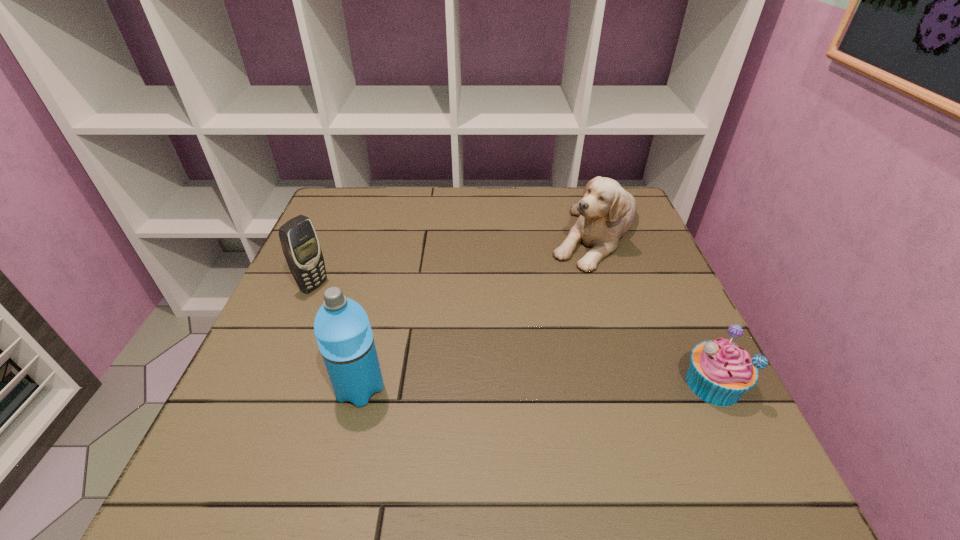
Identify the location of vacant area between the puppy and the third nearest object. The height and width of the screenshot is (540, 960). (454, 259).

Where is `blank region between the muffin and the puppy`? blank region between the muffin and the puppy is located at coordinates (654, 308).

Find the location of a particular element. free area in between the shortest object and the puppy is located at coordinates (654, 308).

This screenshot has width=960, height=540. In order to click on free space between the thermos bottle and the muffin in this screenshot , I will do `click(537, 386)`.

Identify the location of free space that is in between the puppy and the third object from right to left. The width and height of the screenshot is (960, 540). (477, 310).

Where is `vacant space in between the farthest object and the cellular telephone`? The image size is (960, 540). vacant space in between the farthest object and the cellular telephone is located at coordinates (454, 259).

Where is `object that is the second nearest to the farthest object`? The width and height of the screenshot is (960, 540). object that is the second nearest to the farthest object is located at coordinates (342, 329).

Find the location of a particular element. The width and height of the screenshot is (960, 540). object identified as the closest to the farthest object is located at coordinates pos(720,372).

The image size is (960, 540). In order to click on free space that satisfies the following two spatial constraints: 1. on the front side of the thermos bottle; 2. on the right side of the cellular telephone in this screenshot , I will do `click(271, 388)`.